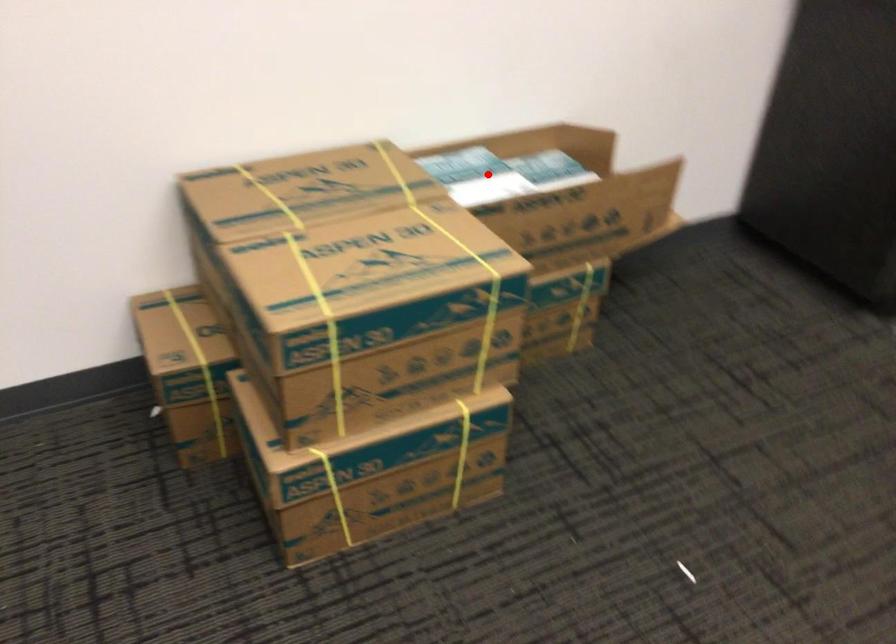
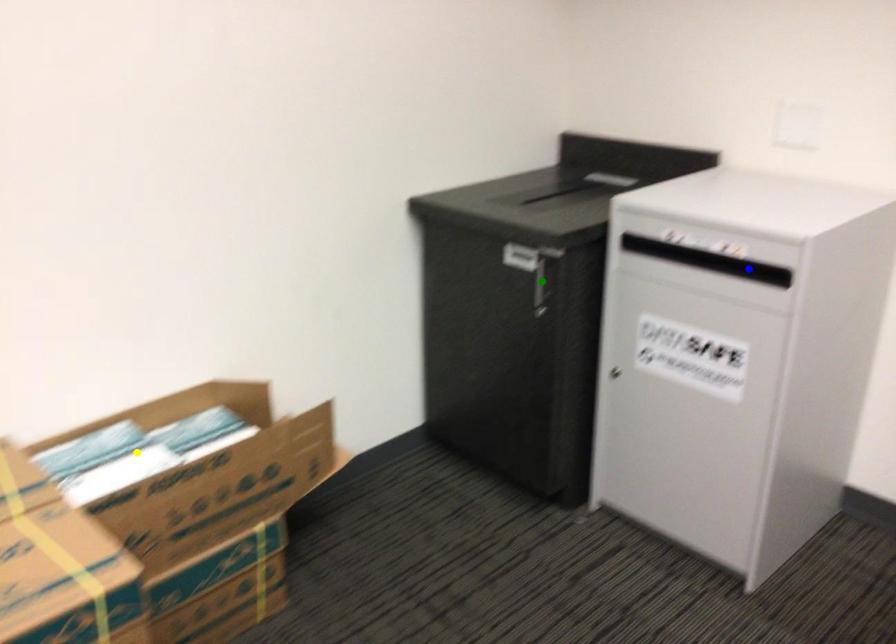
Question: I am providing you with two images of the same scene from different viewpoints. A red point is marked on the first image. You are given multiple points on the second image. Which point in image 2 represents the same 3d spot as the red point in image 1?

Choices:
 (A) yellow point
 (B) green point
 (C) blue point

Answer: (A)